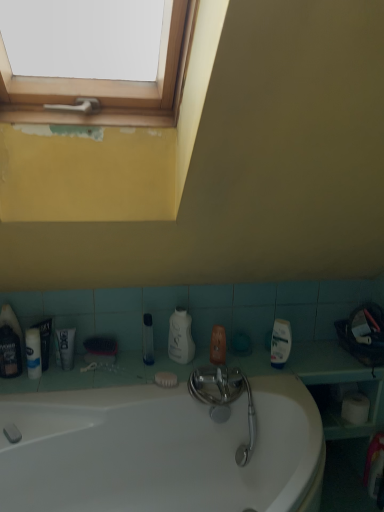
Question: Does white glossy bathtub at center have a lesser height compared to white matte tube at lower left?

Choices:
 (A) yes
 (B) no

Answer: (B)

Question: Can you confirm if white glossy bathtub at center is taller than white matte tube at lower left?

Choices:
 (A) no
 (B) yes

Answer: (B)

Question: Is white glossy bathtub at center bigger than white matte tube at lower left?

Choices:
 (A) yes
 (B) no

Answer: (A)

Question: From a real-world perspective, is white glossy bathtub at center on top of white matte tube at lower left?

Choices:
 (A) yes
 (B) no

Answer: (B)

Question: Is white glossy bathtub at center not close to white matte tube at lower left?

Choices:
 (A) yes
 (B) no

Answer: (B)

Question: From a real-world perspective, is clear plastic tube at center, which is the second mouthwash in left-to-right order, above or below wooden frame at upper left?

Choices:
 (A) above
 (B) below

Answer: (B)

Question: In terms of size, does clear plastic tube at center, which is the second mouthwash in left-to-right order, appear bigger or smaller than wooden frame at upper left?

Choices:
 (A) small
 (B) big

Answer: (A)

Question: From their relative heights in the image, would you say clear plastic tube at center, the first mouthwash when ordered from right to left, is taller or shorter than wooden frame at upper left?

Choices:
 (A) tall
 (B) short

Answer: (B)

Question: Is clear plastic tube at center, the first mouthwash when ordered from right to left, to the left or to the right of wooden frame at upper left in the image?

Choices:
 (A) left
 (B) right

Answer: (A)

Question: Is translucent plastic mouthwash at lower left, the second mouthwash viewed from the back, wider or thinner than white matte soap at lower center?

Choices:
 (A) wide
 (B) thin

Answer: (A)

Question: Is translucent plastic mouthwash at lower left, the first mouthwash in the left-to-right sequence, in front of or behind white matte soap at lower center in the image?

Choices:
 (A) behind
 (B) front

Answer: (B)

Question: Is translucent plastic mouthwash at lower left, the second mouthwash viewed from the back, taller or shorter than white matte soap at lower center?

Choices:
 (A) tall
 (B) short

Answer: (A)

Question: In terms of size, does translucent plastic mouthwash at lower left, the first mouthwash from the front, appear bigger or smaller than white matte soap at lower center?

Choices:
 (A) small
 (B) big

Answer: (B)

Question: Considering the positions of white matte soap at lower center and translucent plastic mouthwash at lower left, the second mouthwash viewed from the back, in the image, is white matte soap at lower center bigger or smaller than translucent plastic mouthwash at lower left, the second mouthwash viewed from the back,?

Choices:
 (A) small
 (B) big

Answer: (A)

Question: Is point (157, 379) closer or farther from the camera than point (1, 330)?

Choices:
 (A) closer
 (B) farther

Answer: (B)